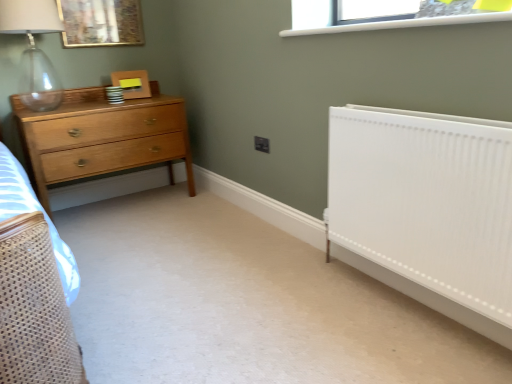
Question: Is clear glass window at upper center far from white smooth radiator at right?

Choices:
 (A) no
 (B) yes

Answer: (A)

Question: Does clear glass window at upper center lie in front of white smooth radiator at right?

Choices:
 (A) yes
 (B) no

Answer: (B)

Question: From the image's perspective, would you say clear glass window at upper center is shown under white smooth radiator at right?

Choices:
 (A) yes
 (B) no

Answer: (B)

Question: Does clear glass window at upper center have a larger size compared to white smooth radiator at right?

Choices:
 (A) no
 (B) yes

Answer: (A)

Question: Can you confirm if clear glass window at upper center is smaller than white smooth radiator at right?

Choices:
 (A) no
 (B) yes

Answer: (B)

Question: Is clear glass window at upper center turned away from white smooth radiator at right?

Choices:
 (A) yes
 (B) no

Answer: (B)

Question: Can you confirm if white smooth radiator at right is shorter than light brown wood chest of drawers at left?

Choices:
 (A) yes
 (B) no

Answer: (B)

Question: Considering the relative sizes of white smooth radiator at right and light brown wood chest of drawers at left in the image provided, is white smooth radiator at right thinner than light brown wood chest of drawers at left?

Choices:
 (A) no
 (B) yes

Answer: (B)

Question: Is white smooth radiator at right taller than light brown wood chest of drawers at left?

Choices:
 (A) yes
 (B) no

Answer: (A)

Question: Could you tell me if white smooth radiator at right is turned towards light brown wood chest of drawers at left?

Choices:
 (A) no
 (B) yes

Answer: (A)

Question: Is white smooth radiator at right in contact with light brown wood chest of drawers at left?

Choices:
 (A) no
 (B) yes

Answer: (A)

Question: Is light brown wood chest of drawers at left at the back of white smooth radiator at right?

Choices:
 (A) no
 (B) yes

Answer: (A)

Question: Is white smooth radiator at right oriented away from clear glass window at upper center?

Choices:
 (A) yes
 (B) no

Answer: (B)